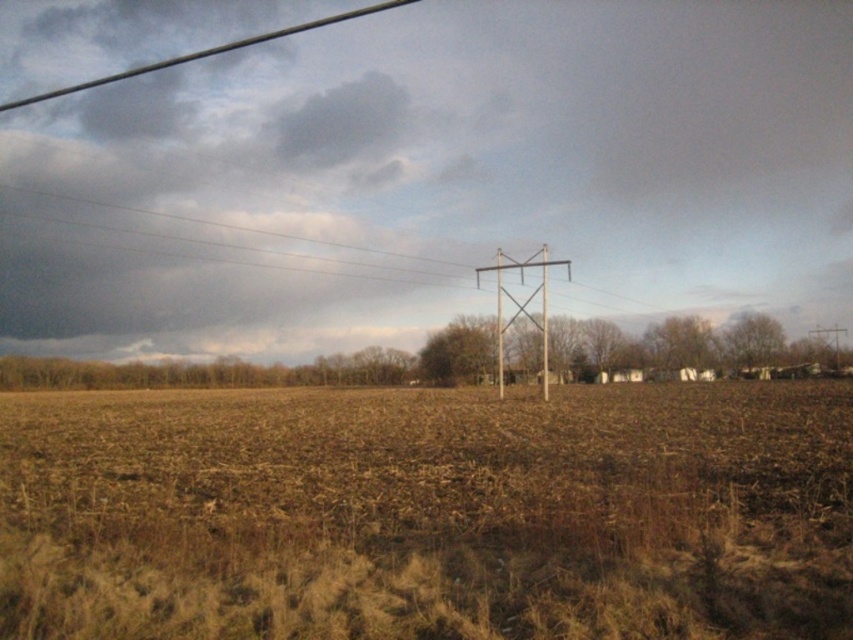
Does smooth wood telegraph pole at center have a larger size compared to metallic wire at upper left?

Yes, smooth wood telegraph pole at center is bigger than metallic wire at upper left.

Who is more distant from viewer, (514,260) or (274,33)?

Positioned behind is point (274,33).

Does point (474, 273) lie in front of point (44, 99)?

Yes, it is.

The width and height of the screenshot is (853, 640). Identify the location of smooth wood telegraph pole at center. (521, 305).

Can you confirm if brown grass at center is smaller than smooth wood telegraph pole at center?

Yes.

Between point (337, 497) and point (541, 340), which one is positioned in front?

Point (337, 497) is more forward.

Identify the location of brown grass at center. (428, 515).

Between brown grass at center and metallic wire at upper left, which one is positioned higher?

metallic wire at upper left is above.

Who is lower down, brown grass at center or metallic wire at upper left?

brown grass at center is below.

Between point (480, 586) and point (238, 45), which one is positioned behind?

Positioned behind is point (238, 45).

Find the location of a particular element. The width and height of the screenshot is (853, 640). brown grass at center is located at coordinates (428, 515).